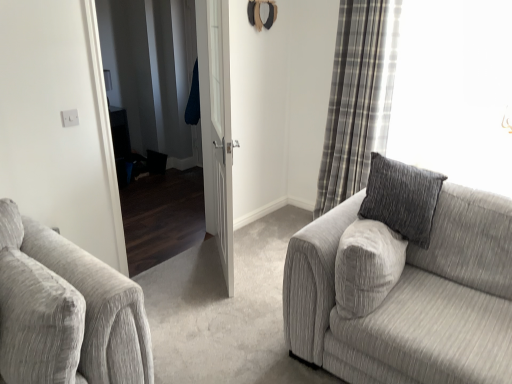
Question: Considering the positions of point (201, 46) and point (315, 306), is point (201, 46) closer or farther from the camera than point (315, 306)?

Choices:
 (A) closer
 (B) farther

Answer: (B)

Question: Considering the positions of white wooden door at center and textured gray couch at right in the image, is white wooden door at center bigger or smaller than textured gray couch at right?

Choices:
 (A) big
 (B) small

Answer: (B)

Question: Estimate the real-world distances between objects in this image. Which object is farther from the plaid fabric curtain at right?

Choices:
 (A) white wooden door at center
 (B) textured gray couch at right

Answer: (B)

Question: Considering the real-world distances, which object is farthest from the textured gray couch at right?

Choices:
 (A) plaid fabric curtain at right
 (B) white wooden door at center

Answer: (A)